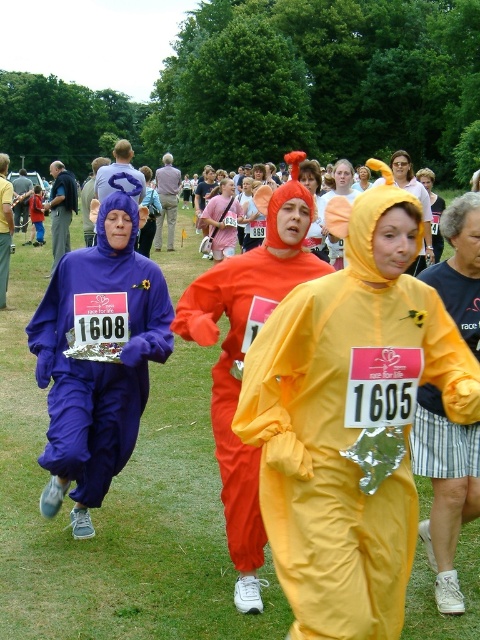
You are a race organizer trying to determine if the purple matte jumpsuit at left and the orange fabric costume at center are within the same 50 feet race segment. Can you confirm this?

The distance between the purple matte jumpsuit at left and the orange fabric costume at center is 43.89 feet, which is less than 50 feet, so they are within the same race segment.